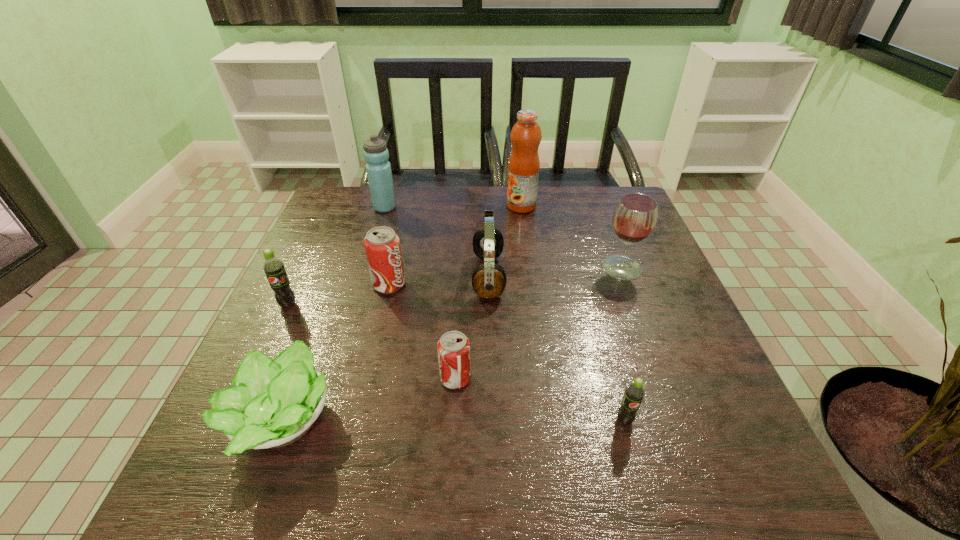
Where is `free space between the farthest soda and the headset`? free space between the farthest soda and the headset is located at coordinates (439, 280).

The height and width of the screenshot is (540, 960). I want to click on unoccupied area between the headset and the bigger pink soda can, so click(439, 280).

This screenshot has height=540, width=960. Identify the location of free point between the left pink soda can and the headset. (439, 280).

The image size is (960, 540). Identify the location of object that is the sixth closest to the wineglass. (378, 168).

Where is `object identified as the fifth closest to the second soda from left to right`? object identified as the fifth closest to the second soda from left to right is located at coordinates (378, 168).

The height and width of the screenshot is (540, 960). I want to click on soda identified as the second closest to the seventh object from left to right, so click(453, 347).

Identify which soda is the nearest to the farther pink soda can. Please provide its 2D coordinates. Your answer should be formatted as a tuple, i.e. [(x, y)], where the tuple contains the x and y coordinates of a point satisfying the conditions above.

[(273, 267)]

Identify the location of vacant space that satisfies the following two spatial constraints: 1. on the ear cups of the headset; 2. on the front label of the bigger green soda. (489, 305).